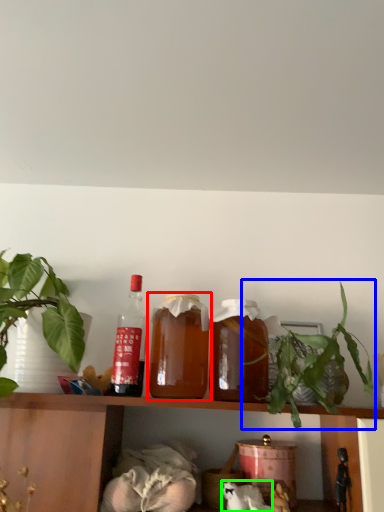
Question: Which object is the closest to the bottle (highlighted by a red box)? Choose among these: houseplant (highlighted by a blue box) or animal (highlighted by a green box).

Choices:
 (A) houseplant
 (B) animal

Answer: (A)